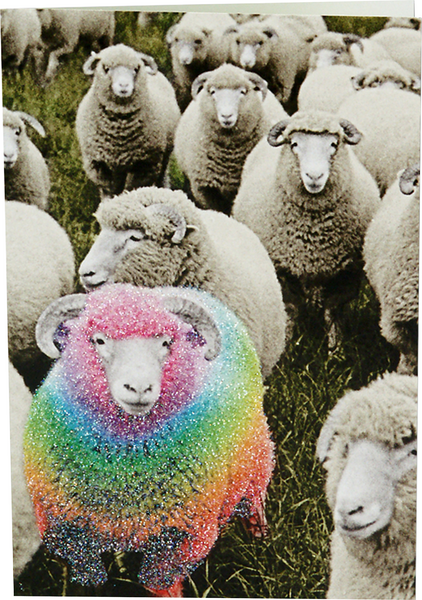
Identify the location of darker chest. The width and height of the screenshot is (422, 600). (118, 144).